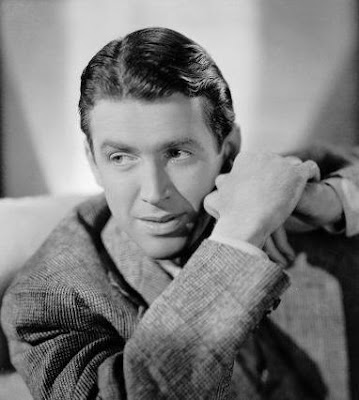
The image size is (359, 400). I want to click on lighting, so click(x=239, y=53).